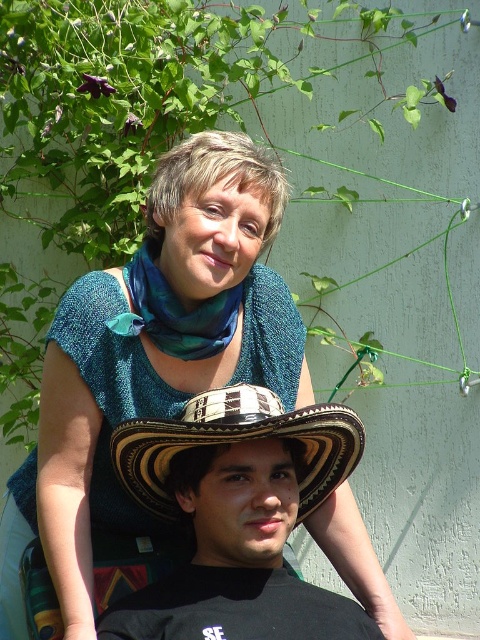
Question: Which point is closer to the camera?

Choices:
 (A) brown woven hat at lower center
 (B) teal textured sweater at upper center
 (C) brown woven straw cowboy hat at center

Answer: (C)

Question: Considering the real-world distances, which object is farthest from the brown woven straw cowboy hat at center?

Choices:
 (A) teal textured sweater at upper center
 (B) brown woven hat at lower center

Answer: (A)

Question: Is brown woven hat at lower center below brown woven straw cowboy hat at center?

Choices:
 (A) no
 (B) yes

Answer: (B)

Question: Does teal textured sweater at upper center have a larger size compared to brown woven hat at lower center?

Choices:
 (A) no
 (B) yes

Answer: (B)

Question: Can you confirm if brown woven hat at lower center is positioned to the left of brown woven straw cowboy hat at center?

Choices:
 (A) no
 (B) yes

Answer: (A)

Question: Which object appears farthest from the camera in this image?

Choices:
 (A) brown woven straw cowboy hat at center
 (B) brown woven hat at lower center
 (C) teal textured sweater at upper center

Answer: (C)